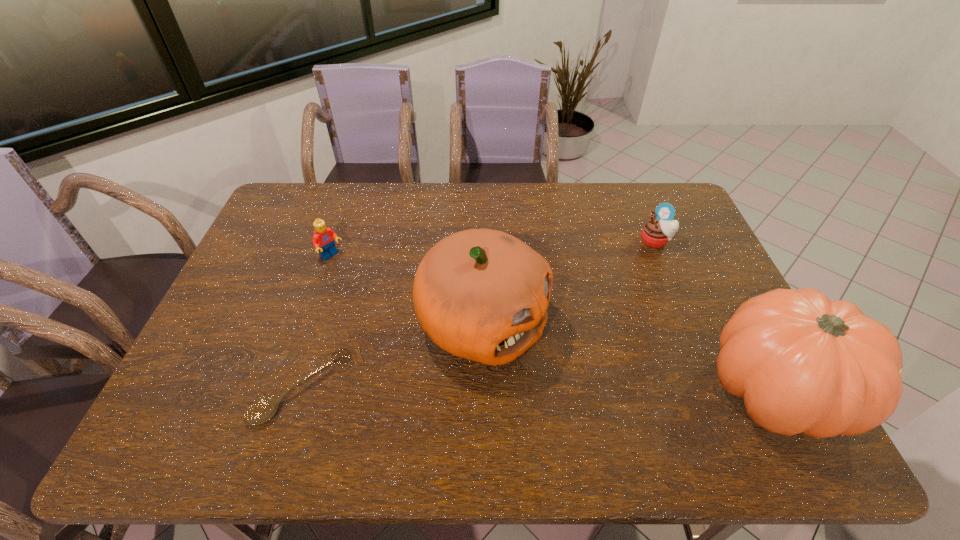
Locate an element on the screen. This screenshot has width=960, height=540. blank region between the left pumpkin and the Lego is located at coordinates (407, 291).

Locate an element on the screen. Image resolution: width=960 pixels, height=540 pixels. free space between the Lego and the ladle is located at coordinates (317, 322).

I want to click on empty location between the left pumpkin and the shortest object, so click(393, 356).

What are the coordinates of `object that is the fourth closest one to the third object from right to left` in the screenshot? It's located at (656, 232).

What are the coordinates of `object identified as the second closest to the ladle` in the screenshot? It's located at (323, 239).

Identify the location of vacant area that satisfies the following two spatial constraints: 1. on the front side of the Lego; 2. on the carved face of the right pumpkin. (286, 390).